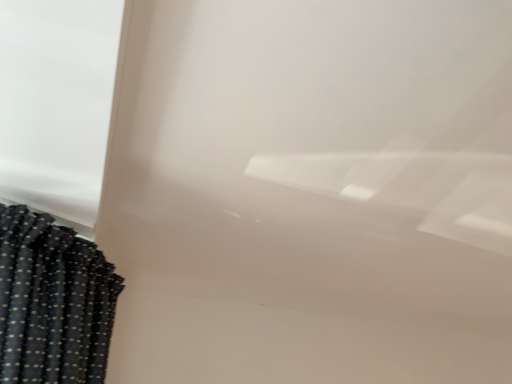
Find the location of `white glossy curtain at left`. white glossy curtain at left is located at coordinates (57, 105).

The width and height of the screenshot is (512, 384). Describe the element at coordinates (57, 105) in the screenshot. I see `white glossy curtain at left` at that location.

Measure the distance between point (83,211) and camera.

They are 1.26 meters apart.

Identify the location of white glossy curtain at left. Image resolution: width=512 pixels, height=384 pixels. [57, 105].